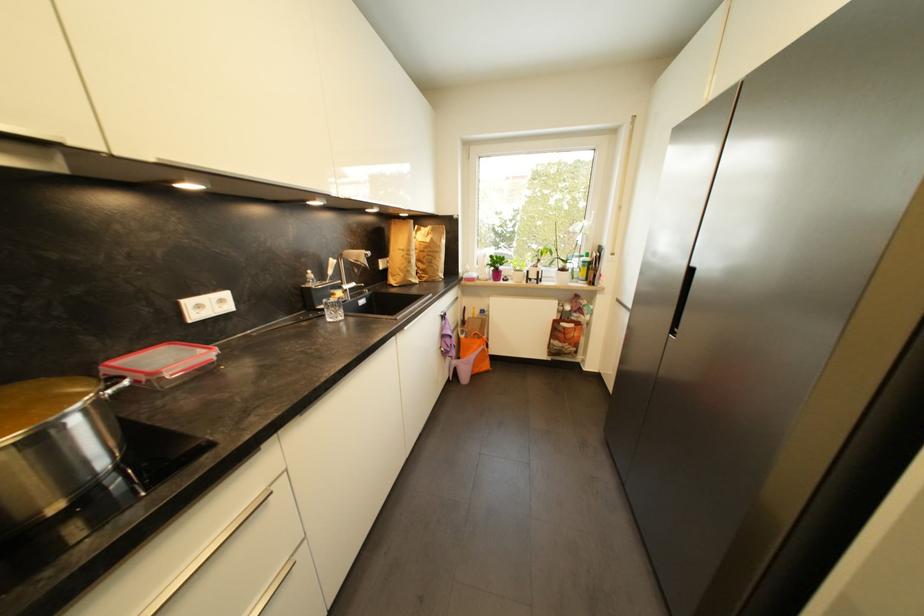
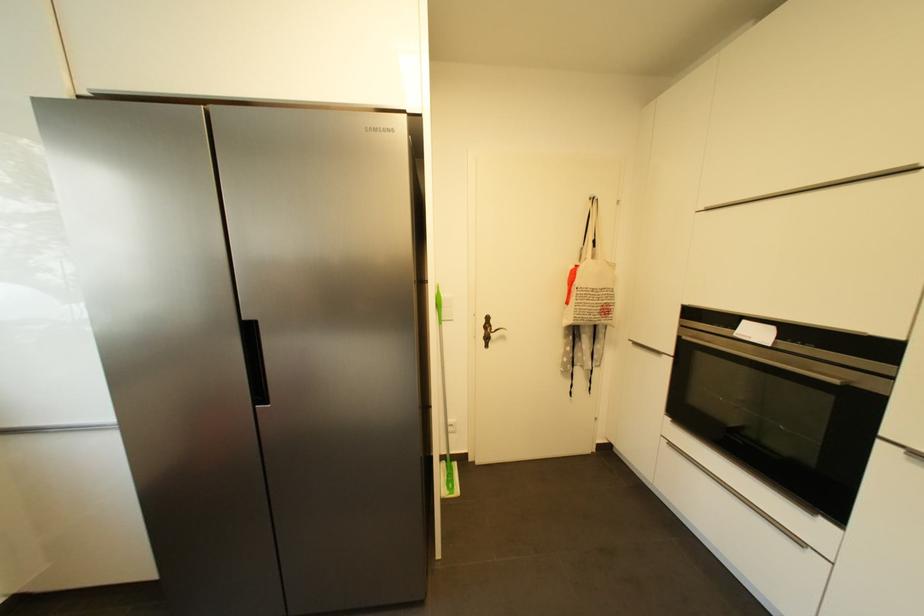
Based on the continuous images, in which direction is the camera rotating?

The camera's rotation is toward right-down.